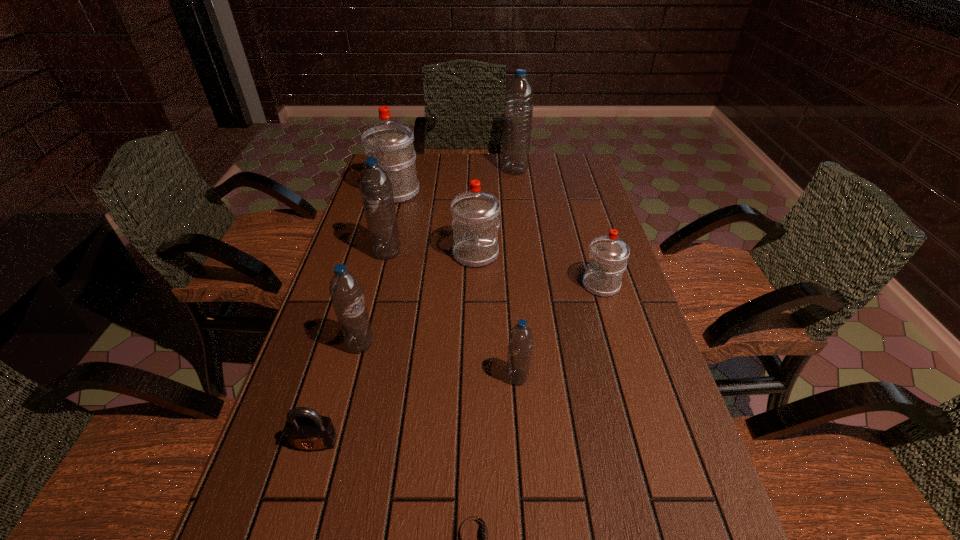
Identify the location of the smallest blue water bottle. (520, 342).

The image size is (960, 540). What are the coordinates of `the rightmost white water bottle` in the screenshot? It's located at (608, 254).

Where is `the rightmost object`? The width and height of the screenshot is (960, 540). the rightmost object is located at coordinates (608, 254).

Identify the location of gray padlock. The width and height of the screenshot is (960, 540). (305, 429).

Identify the location of the second nearest object. This screenshot has width=960, height=540. (305, 429).

The height and width of the screenshot is (540, 960). Identify the location of free space located 0.370m on the left of the farthest object. (404, 171).

The height and width of the screenshot is (540, 960). I want to click on vacant space located 0.150m on the front of the third smallest blue water bottle, so click(376, 299).

Locate an element on the screen. Image resolution: width=960 pixels, height=540 pixels. vacant space located on the back of the second smallest blue water bottle is located at coordinates (374, 291).

In order to click on free space located on the handle side of the second nearest white water bottle in this screenshot , I will do `click(475, 302)`.

Where is `vacant space located 0.140m on the right of the third nearest object`? vacant space located 0.140m on the right of the third nearest object is located at coordinates (592, 377).